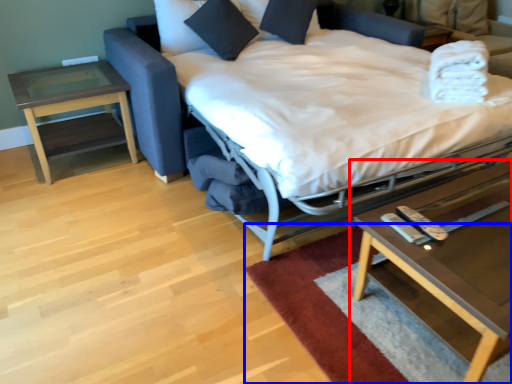
Question: Which object appears farthest to the camera in this image, coffee table (highlighted by a red box) or mat (highlighted by a blue box)?

Choices:
 (A) coffee table
 (B) mat

Answer: (B)